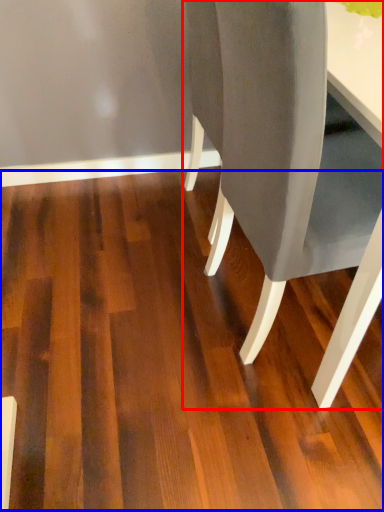
Question: Which of the following is the farthest to the observer, chair (highlighted by a red box) or plywood (highlighted by a blue box)?

Choices:
 (A) chair
 (B) plywood

Answer: (B)